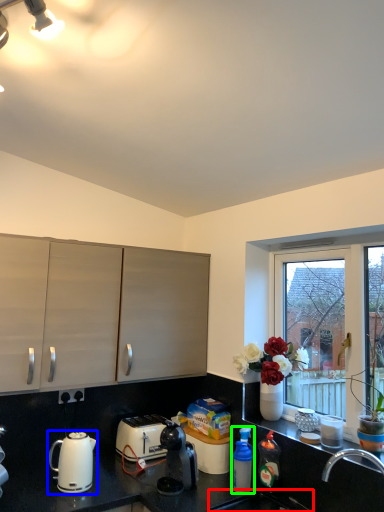
Question: Which object is positioned closest to sink (highlighted by a red box)? Select from kettle (highlighted by a blue box) and bottle (highlighted by a green box).

Choices:
 (A) kettle
 (B) bottle

Answer: (B)